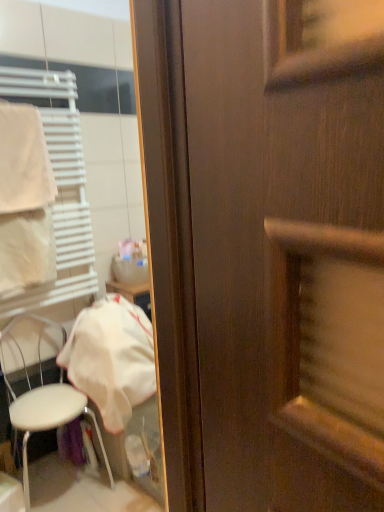
Where is `free location above white plastic towel rack at left (from a real-world perspective)`? free location above white plastic towel rack at left (from a real-world perspective) is located at coordinates (37, 75).